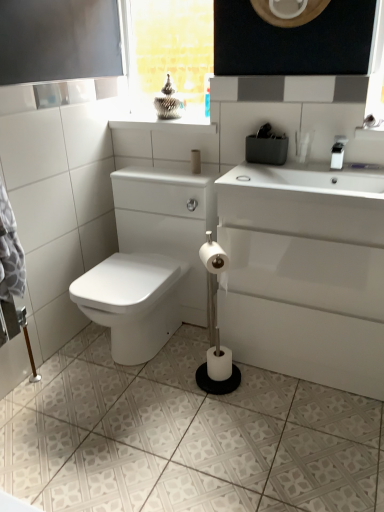
Question: In the image, is white matte toilet paper at center, the second toilet paper when ordered from front to back, positioned in front of or behind white matte soap at upper right?

Choices:
 (A) behind
 (B) front

Answer: (A)

Question: From their relative heights in the image, would you say white matte toilet paper at center, which is the second toilet paper from back to front, is taller or shorter than white matte soap at upper right?

Choices:
 (A) short
 (B) tall

Answer: (B)

Question: Estimate the real-world distances between objects in this image. Which object is closer to the white glossy porcelain at lower right?

Choices:
 (A) matte beige toilet paper at center, arranged as the third toilet paper when ordered from the bottom
 (B) white matte toilet paper at center, the 1th toilet paper in the bottom-to-top sequence
 (C) white matte toilet paper at center, the 2th toilet paper from the bottom
 (D) white plastic faucet at upper right
 (E) white glossy ceramic tile at lower center

Answer: (C)

Question: Considering the real-world distances, which object is farthest from the white glossy porcelain at lower right?

Choices:
 (A) clear glass window at upper center
 (B) white matte soap at upper right
 (C) matte beige toilet paper at center, acting as the 3th toilet paper starting from the front
 (D) white matte toilet paper at center, the 2th toilet paper from the bottom
 (E) white plastic faucet at upper right

Answer: (A)